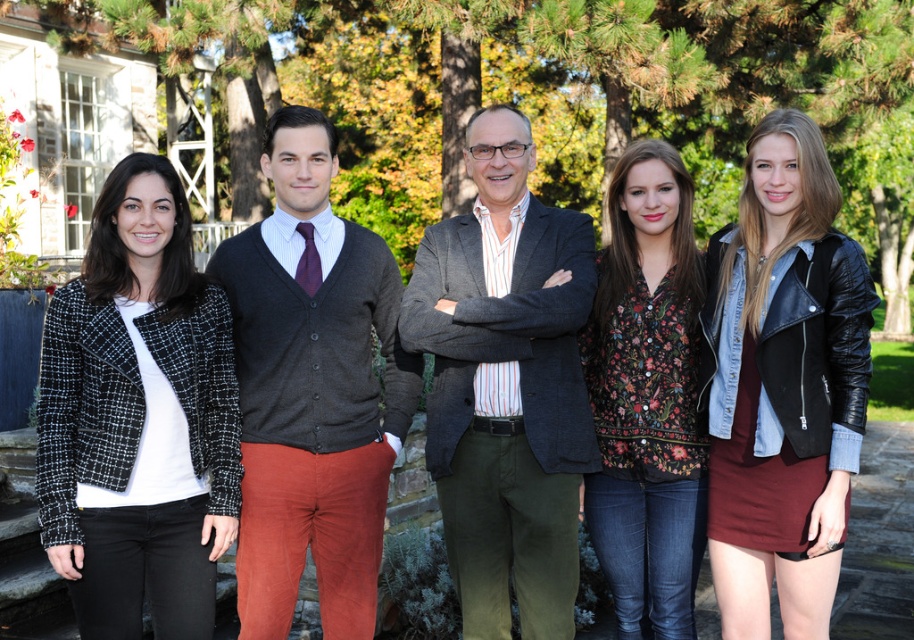
You are a photographer trying to capture a clear shot of the dark gray wool sweater at center without the floral print blouse at center blocking it. Based on the scene, is this possible?

Yes, since the dark gray wool sweater at center is in front of the floral print blouse at center, you can capture a clear shot of the dark gray wool sweater at center without obstruction from the floral print blouse at center.

You are a photographer trying to capture a group photo of the leather jacket at center and the floral print blouse at center. Which one should you focus on first if you want to start from the left side of the group?

The floral print blouse at center should be focused on first because it is positioned to the left of the leather jacket at center.